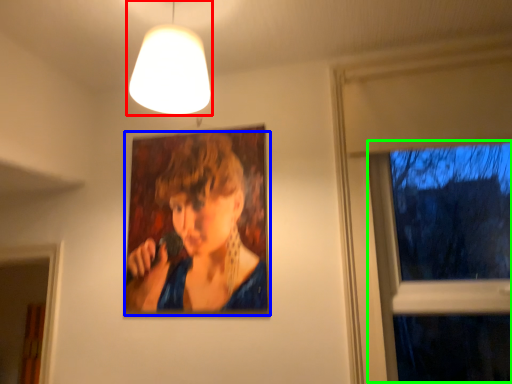
Question: Which object is positioned closest to lamp (highlighted by a red box)? Select from person (highlighted by a blue box) and window (highlighted by a green box).

Choices:
 (A) person
 (B) window

Answer: (A)